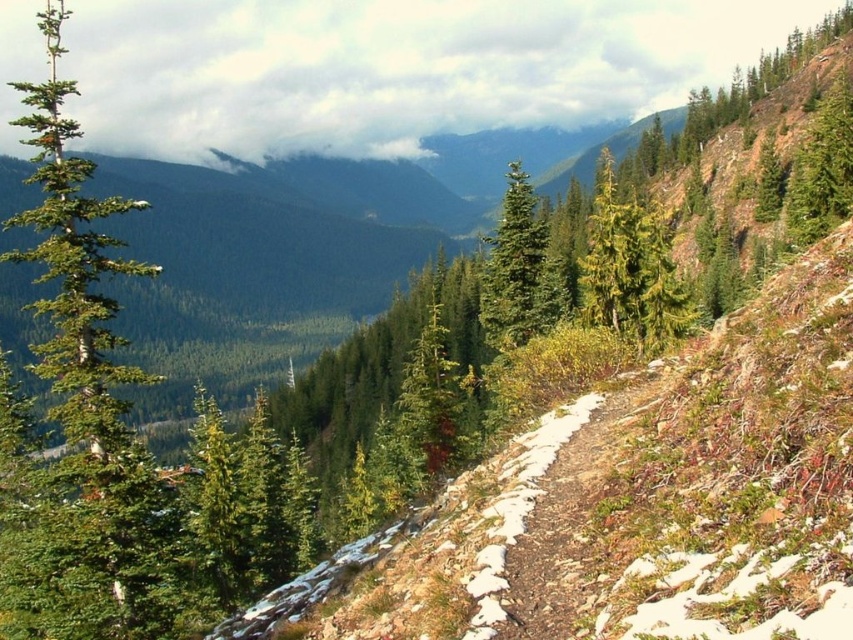
You are a hiker standing on the mountain trail and want to reach the green textured tree at upper right. Which direction should you move relative to the green matte tree at center?

To reach the green textured tree at upper right, you should move to the right of the green matte tree at center since the green textured tree at upper right is located to its right side.

You are a hiker on the mountain trail and want to take a photo of the green matte tree at left and the green matte tree at center. Which tree is positioned more to the left in the frame?

The green matte tree at left is positioned more to the left than the green matte tree at center.